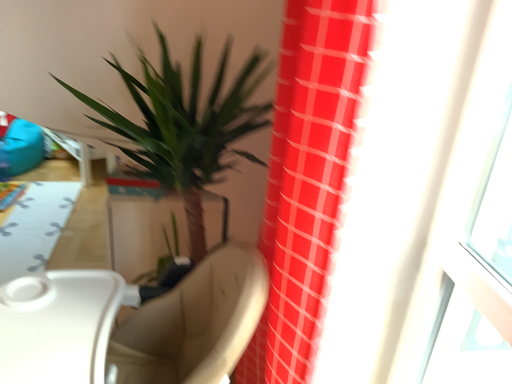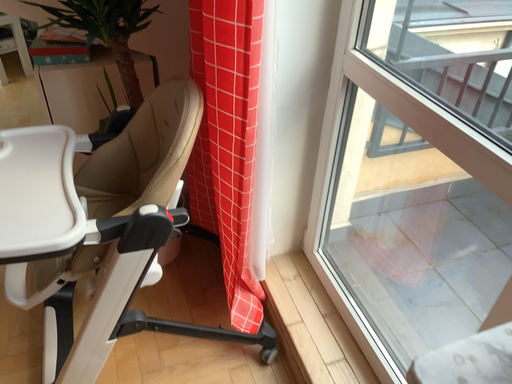
Question: How did the camera likely rotate when shooting the video?

Choices:
 (A) rotated left
 (B) rotated right

Answer: (B)